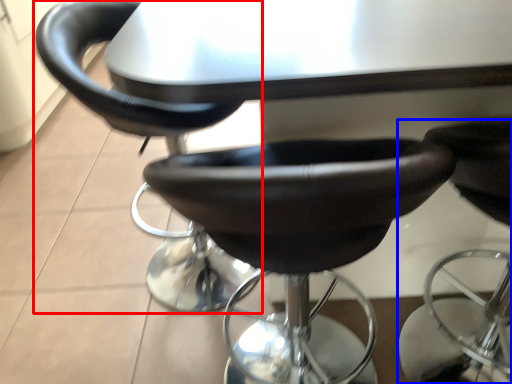
Question: Which object appears farthest to the camera in this image, chair (highlighted by a red box) or chair (highlighted by a blue box)?

Choices:
 (A) chair
 (B) chair

Answer: (A)